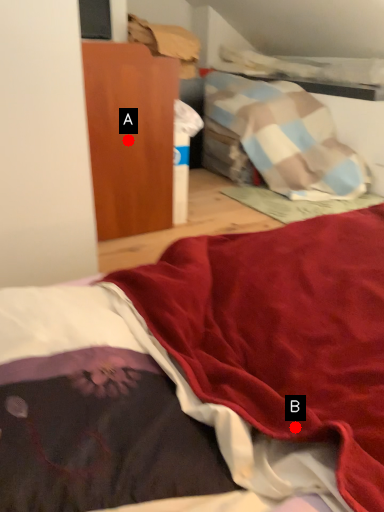
Question: Two points are circled on the image, labeled by A and B beside each circle. Among these points, which one is nearest to the camera?

Choices:
 (A) A is closer
 (B) B is closer

Answer: (B)